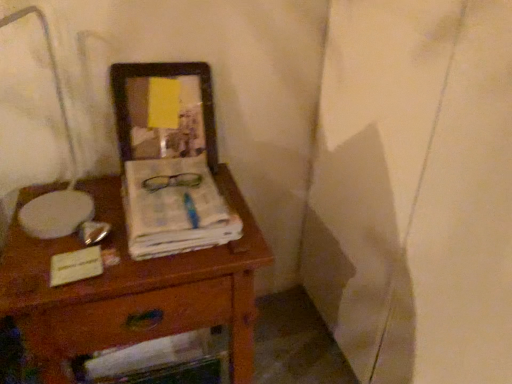
Question: Could wooden desk at center be considered to be inside wooden drawer at lower center?

Choices:
 (A) no
 (B) yes

Answer: (A)

Question: Does wooden drawer at lower center come in front of wooden desk at center?

Choices:
 (A) yes
 (B) no

Answer: (B)

Question: From a real-world perspective, is wooden drawer at lower center over wooden desk at center?

Choices:
 (A) no
 (B) yes

Answer: (A)

Question: Is wooden drawer at lower center with wooden desk at center?

Choices:
 (A) no
 (B) yes

Answer: (B)

Question: Does wooden drawer at lower center turn towards wooden desk at center?

Choices:
 (A) yes
 (B) no

Answer: (A)

Question: From the image's perspective, is wooden drawer at lower center located beneath wooden desk at center?

Choices:
 (A) no
 (B) yes

Answer: (B)

Question: Does white paper at center have a lesser height compared to wooden picture frame at upper center?

Choices:
 (A) yes
 (B) no

Answer: (A)

Question: Is white paper at center located outside wooden picture frame at upper center?

Choices:
 (A) no
 (B) yes

Answer: (B)

Question: Does white paper at center appear on the right side of wooden picture frame at upper center?

Choices:
 (A) yes
 (B) no

Answer: (A)

Question: From a real-world perspective, does white paper at center sit lower than wooden picture frame at upper center?

Choices:
 (A) no
 (B) yes

Answer: (B)

Question: Considering the relative sizes of white paper at center and wooden picture frame at upper center in the image provided, is white paper at center bigger than wooden picture frame at upper center?

Choices:
 (A) yes
 (B) no

Answer: (B)

Question: From a real-world perspective, is white paper at center positioned over wooden picture frame at upper center based on gravity?

Choices:
 (A) no
 (B) yes

Answer: (A)

Question: Is the depth of white paper at center less than that of wooden desk at center?

Choices:
 (A) yes
 (B) no

Answer: (B)